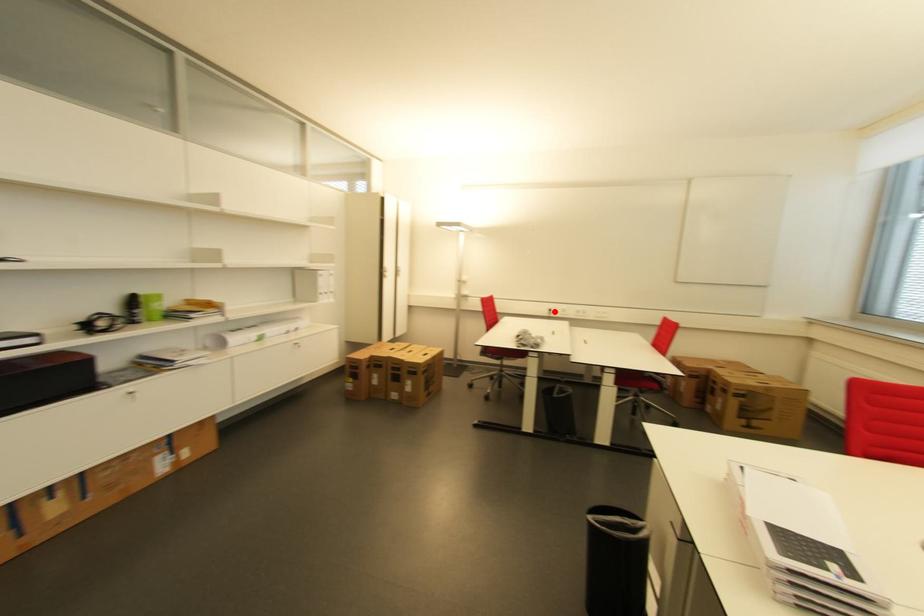
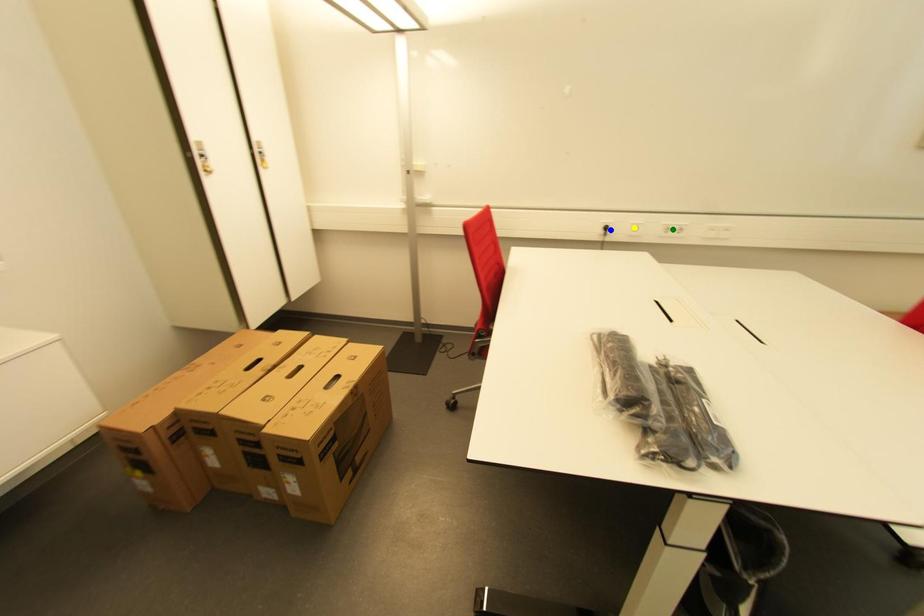
Question: I am providing you with two images of the same scene from different viewpoints. A red point is marked on the first image. You are given multiple points on the second image. Can you choose the point in image 2 that corresponds to the point in image 1?

Choices:
 (A) blue point
 (B) green point
 (C) yellow point

Answer: (A)